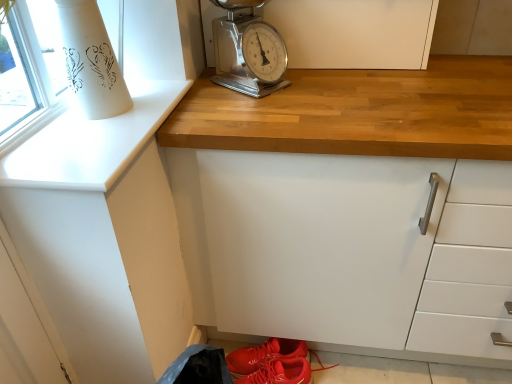
The height and width of the screenshot is (384, 512). Describe the element at coordinates (264, 354) in the screenshot. I see `shiny leather sneakers at lower center` at that location.

Identify the location of white matte cabinet at upper center, marked as the 1th cabinetry in a front-to-back arrangement. [111, 210].

Where is `shiny leather sneakers at lower center`? shiny leather sneakers at lower center is located at coordinates (264, 354).

Is metallic scale at upper center bigger or smaller than white matte cabinet at upper center, marked as the 1th cabinetry in a front-to-back arrangement?

Clearly, metallic scale at upper center is smaller in size than white matte cabinet at upper center, marked as the 1th cabinetry in a front-to-back arrangement.

Which object is positioned more to the left, metallic scale at upper center or white matte cabinet at upper center, placed as the 2th cabinetry when sorted from back to front?

From the viewer's perspective, white matte cabinet at upper center, placed as the 2th cabinetry when sorted from back to front, appears more on the left side.

Relative to white matte cabinet at upper center, placed as the 2th cabinetry when sorted from back to front, is metallic scale at upper center in front or behind?

metallic scale at upper center is behind white matte cabinet at upper center, placed as the 2th cabinetry when sorted from back to front.

Is white matte cabinet at upper center, marked as the 1th cabinetry in a front-to-back arrangement, looking in the opposite direction of white matte cabinet at upper center, placed as the first cabinetry when sorted from back to front?

No, white matte cabinet at upper center, marked as the 1th cabinetry in a front-to-back arrangement,'s orientation is not away from white matte cabinet at upper center, placed as the first cabinetry when sorted from back to front.

How distant is white matte cabinet at upper center, placed as the 2th cabinetry when sorted from back to front, from white matte cabinet at upper center, the second cabinetry from the front?

The distance of white matte cabinet at upper center, placed as the 2th cabinetry when sorted from back to front, from white matte cabinet at upper center, the second cabinetry from the front, is 22.92 inches.

Is white matte cabinet at upper center, marked as the 1th cabinetry in a front-to-back arrangement, not close to white matte cabinet at upper center, placed as the first cabinetry when sorted from back to front?

Actually, white matte cabinet at upper center, marked as the 1th cabinetry in a front-to-back arrangement, and white matte cabinet at upper center, placed as the first cabinetry when sorted from back to front, are a little close together.

Can you confirm if white matte cabinet at upper center, placed as the 2th cabinetry when sorted from back to front, is thinner than white matte cabinet at upper center, the second cabinetry from the front?

In fact, white matte cabinet at upper center, placed as the 2th cabinetry when sorted from back to front, might be wider than white matte cabinet at upper center, the second cabinetry from the front.

Can you confirm if metallic scale at upper center is taller than shiny leather sneakers at lower center?

Indeed, metallic scale at upper center has a greater height compared to shiny leather sneakers at lower center.

Is shiny leather sneakers at lower center located within metallic scale at upper center?

No, shiny leather sneakers at lower center is not a part of metallic scale at upper center.

From a real-world perspective, is metallic scale at upper center physically below shiny leather sneakers at lower center?

No, from a real-world perspective, metallic scale at upper center is not under shiny leather sneakers at lower center.

Is point (216, 69) more distant than point (244, 370)?

That is False.

Considering the relative positions of white matte cabinet at upper center, placed as the first cabinetry when sorted from back to front, and metallic scale at upper center in the image provided, is white matte cabinet at upper center, placed as the first cabinetry when sorted from back to front, to the left of metallic scale at upper center from the viewer's perspective?

No, white matte cabinet at upper center, placed as the first cabinetry when sorted from back to front, is not to the left of metallic scale at upper center.

From the image's perspective, who appears lower, white matte cabinet at upper center, the second cabinetry from the front, or metallic scale at upper center?

metallic scale at upper center is shown below in the image.

How far apart are white matte cabinet at upper center, the second cabinetry from the front, and metallic scale at upper center?

19.08 centimeters.

Identify the location of cabinetry above the metallic scale at upper center (from the image's perspective). (355, 32).

Could white matte cabinet at upper center, placed as the first cabinetry when sorted from back to front, be considered to be inside metallic scale at upper center?

Actually, white matte cabinet at upper center, placed as the first cabinetry when sorted from back to front, is outside metallic scale at upper center.

Is metallic scale at upper center next to white matte cabinet at upper center, placed as the first cabinetry when sorted from back to front?

There is a gap between metallic scale at upper center and white matte cabinet at upper center, placed as the first cabinetry when sorted from back to front.

Does metallic scale at upper center have a larger size compared to white matte cabinet at upper center, placed as the first cabinetry when sorted from back to front?

No, metallic scale at upper center is not bigger than white matte cabinet at upper center, placed as the first cabinetry when sorted from back to front.

Is metallic scale at upper center facing towards white matte cabinet at upper center, the second cabinetry from the front?

No, metallic scale at upper center is not turned towards white matte cabinet at upper center, the second cabinetry from the front.

From a real-world perspective, which is physically above, white matte cabinet at upper center, marked as the 1th cabinetry in a front-to-back arrangement, or metallic scale at upper center?

In real-world perspective, white matte cabinet at upper center, marked as the 1th cabinetry in a front-to-back arrangement, is above.

Are white matte cabinet at upper center, placed as the 2th cabinetry when sorted from back to front, and metallic scale at upper center making contact?

No, white matte cabinet at upper center, placed as the 2th cabinetry when sorted from back to front, is not making contact with metallic scale at upper center.

Looking at the image, does white matte cabinet at upper center, marked as the 1th cabinetry in a front-to-back arrangement, seem bigger or smaller compared to metallic scale at upper center?

In the image, white matte cabinet at upper center, marked as the 1th cabinetry in a front-to-back arrangement, appears to be larger than metallic scale at upper center.

Could you tell me if white matte cabinet at upper center, placed as the 2th cabinetry when sorted from back to front, is turned towards metallic scale at upper center?

No, white matte cabinet at upper center, placed as the 2th cabinetry when sorted from back to front, is not aimed at metallic scale at upper center.

Is white matte cabinet at upper center, marked as the 1th cabinetry in a front-to-back arrangement, at the back of white matte cabinet at upper center, placed as the first cabinetry when sorted from back to front?

No, white matte cabinet at upper center, placed as the first cabinetry when sorted from back to front, is not facing away from white matte cabinet at upper center, marked as the 1th cabinetry in a front-to-back arrangement.

Which of these two, white matte cabinet at upper center, the second cabinetry from the front, or white matte cabinet at upper center, placed as the 2th cabinetry when sorted from back to front, is bigger?

white matte cabinet at upper center, placed as the 2th cabinetry when sorted from back to front.

Are white matte cabinet at upper center, placed as the first cabinetry when sorted from back to front, and white matte cabinet at upper center, marked as the 1th cabinetry in a front-to-back arrangement, making contact?

They are not placed beside each other.

At what (x,y) coordinates should I click in order to perform the action: click on home appliance lying on the right of white matte cabinet at upper center, marked as the 1th cabinetry in a front-to-back arrangement. Please return your answer as a coordinate pair (x, y). Looking at the image, I should click on (248, 50).

At what (x,y) coordinates should I click in order to perform the action: click on cabinetry beneath the white matte cabinet at upper center, marked as the 1th cabinetry in a front-to-back arrangement (from a real-world perspective). Please return your answer as a coordinate pair (x, y). The height and width of the screenshot is (384, 512). Looking at the image, I should click on (355, 32).

Looking at this image, considering their positions, is metallic scale at upper center positioned further to shiny leather sneakers at lower center than white matte cabinet at upper center, placed as the 2th cabinetry when sorted from back to front?

Based on the image, metallic scale at upper center appears to be further to shiny leather sneakers at lower center.

Looking at the image, which one is located further to white matte cabinet at upper center, marked as the 1th cabinetry in a front-to-back arrangement, white matte cabinet at upper center, the second cabinetry from the front, or shiny leather sneakers at lower center?

Based on the image, shiny leather sneakers at lower center appears to be further to white matte cabinet at upper center, marked as the 1th cabinetry in a front-to-back arrangement.

Based on their spatial positions, is white matte cabinet at upper center, the second cabinetry from the front, or white matte cabinet at upper center, placed as the 2th cabinetry when sorted from back to front, further from metallic scale at upper center?

white matte cabinet at upper center, placed as the 2th cabinetry when sorted from back to front, lies further to metallic scale at upper center than the other object.

Which object lies further to the anchor point metallic scale at upper center, white matte cabinet at upper center, marked as the 1th cabinetry in a front-to-back arrangement, or white matte cabinet at upper center, placed as the first cabinetry when sorted from back to front?

white matte cabinet at upper center, marked as the 1th cabinetry in a front-to-back arrangement, is positioned further to the anchor metallic scale at upper center.

When comparing their distances from white matte cabinet at upper center, the second cabinetry from the front, does shiny leather sneakers at lower center or white matte cabinet at upper center, marked as the 1th cabinetry in a front-to-back arrangement, seem further?

Among the two, shiny leather sneakers at lower center is located further to white matte cabinet at upper center, the second cabinetry from the front.

Considering their positions, is white matte cabinet at upper center, the second cabinetry from the front, positioned closer to white matte cabinet at upper center, placed as the 2th cabinetry when sorted from back to front, than metallic scale at upper center?

The object closer to white matte cabinet at upper center, placed as the 2th cabinetry when sorted from back to front, is metallic scale at upper center.

Looking at this image, which object lies nearer to the anchor point white matte cabinet at upper center, placed as the 2th cabinetry when sorted from back to front, metallic scale at upper center or white matte cabinet at upper center, the second cabinetry from the front?

Based on the image, metallic scale at upper center appears to be nearer to white matte cabinet at upper center, placed as the 2th cabinetry when sorted from back to front.

Looking at the image, which one is located further to shiny leather sneakers at lower center, white matte cabinet at upper center, marked as the 1th cabinetry in a front-to-back arrangement, or white matte cabinet at upper center, placed as the first cabinetry when sorted from back to front?

white matte cabinet at upper center, placed as the first cabinetry when sorted from back to front, is further to shiny leather sneakers at lower center.

Find the location of a particular element. cabinetry that lies between white matte cabinet at upper center, placed as the first cabinetry when sorted from back to front, and shiny leather sneakers at lower center from top to bottom is located at coordinates (111, 210).

Find the location of a particular element. home appliance positioned between white matte cabinet at upper center, placed as the 2th cabinetry when sorted from back to front, and white matte cabinet at upper center, the second cabinetry from the front, from near to far is located at coordinates (248, 50).

Locate an element on the screen. The height and width of the screenshot is (384, 512). cabinetry between metallic scale at upper center and shiny leather sneakers at lower center from top to bottom is located at coordinates (111, 210).

Identify the location of home appliance between white matte cabinet at upper center, placed as the first cabinetry when sorted from back to front, and shiny leather sneakers at lower center from top to bottom. The image size is (512, 384). (248, 50).